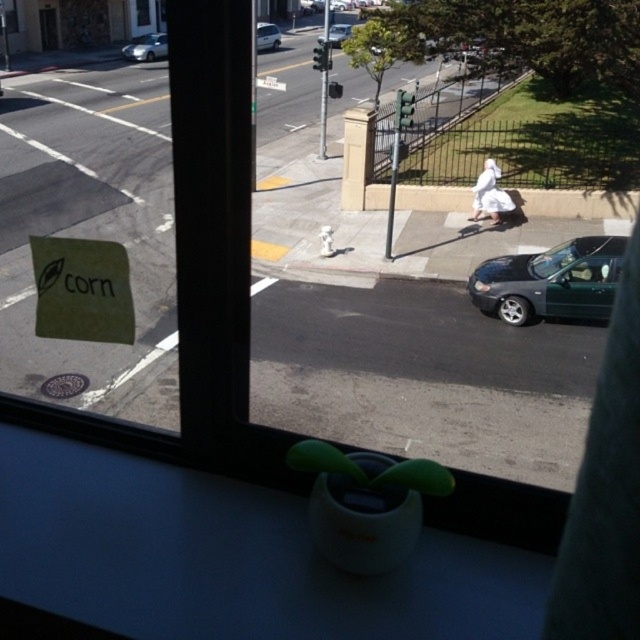
You are a delivery person trying to park your van in the space between the green matte car at lower right and the metallic silver sedan at center. Can you estimate if there is enough space for your van that is 2.5 meters wide?

The green matte car at lower right is to the right of metallic silver sedan at center. Since the distance between them isn not specified, it is impossible to determine if there is enough space for the van.

You are looking through the window and see two points marked on the glass. Which point is closer to you, point at coordinate (593, 250) or point at coordinate (161, 45)?

Point at coordinate (593, 250) is closer to the viewer than point at coordinate (161, 45).

You are a delivery person needing to park your 15 feet long truck between the green matte car at lower right and the metallic silver sedan at center. Can you fit your truck in that space?

The distance between the green matte car at lower right and the metallic silver sedan at center is 42.09 feet. Since your truck is 15 feet long, there is enough space to park it between them.